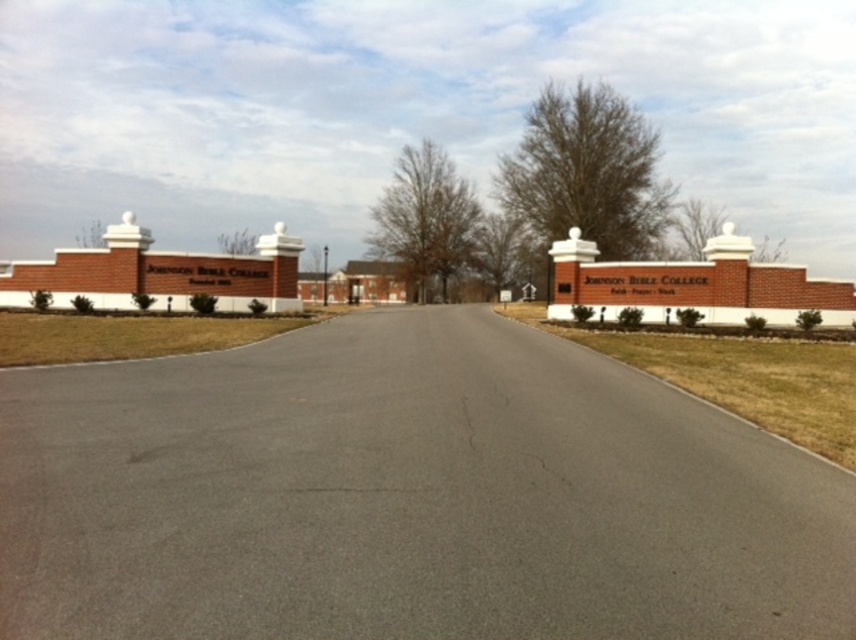
You are a visitor arriving at Johnson Bible College and see the asphalt at center and the brick sign at upper left. Which object is located to the right of the other?

The asphalt at center is positioned on the right side of brick sign at upper left.